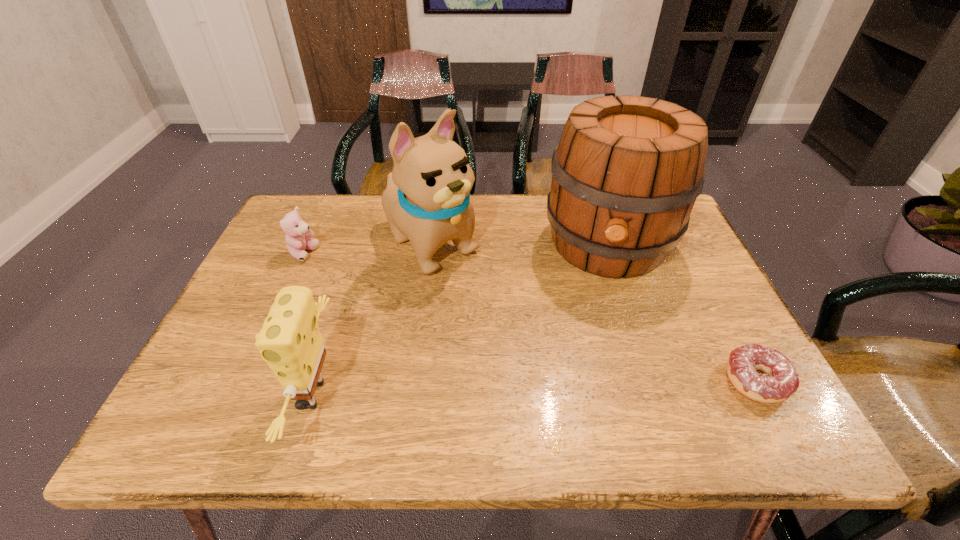
This screenshot has width=960, height=540. Find the location of `the fourth object from right to left`. the fourth object from right to left is located at coordinates (290, 342).

Find the location of a particular element. The image size is (960, 540). the third shortest object is located at coordinates (290, 342).

The height and width of the screenshot is (540, 960). What are the coordinates of `doughnut` in the screenshot? It's located at 781,380.

At what (x,y) coordinates should I click in order to perform the action: click on the second shortest object. Please return your answer as a coordinate pair (x, y). The image size is (960, 540). Looking at the image, I should click on (297, 231).

Locate an element on the screen. This screenshot has width=960, height=540. the leftmost object is located at coordinates (297, 231).

At what (x,y) coordinates should I click in order to perform the action: click on cider. Please return your answer as a coordinate pair (x, y). Looking at the image, I should click on (x=626, y=173).

At what (x,y) coordinates should I click in order to perform the action: click on puppy. Please return your answer as a coordinate pair (x, y). Looking at the image, I should click on pos(427,199).

Find the location of a particular element. Image resolution: width=960 pixels, height=540 pixels. vacant space situated 0.060m on the face of the second object from left to right is located at coordinates (255, 395).

Where is `free space located on the face of the second object from left to right`? The height and width of the screenshot is (540, 960). free space located on the face of the second object from left to right is located at coordinates (235, 395).

You are a GUI agent. You are given a task and a screenshot of the screen. Output one action in this format:
    pyautogui.click(x=<x>, y=<y>)
    Task: Click on the free space located on the face of the second object from left to right
    This screenshot has height=540, width=960.
    Given the screenshot: What is the action you would take?
    pyautogui.click(x=226, y=395)